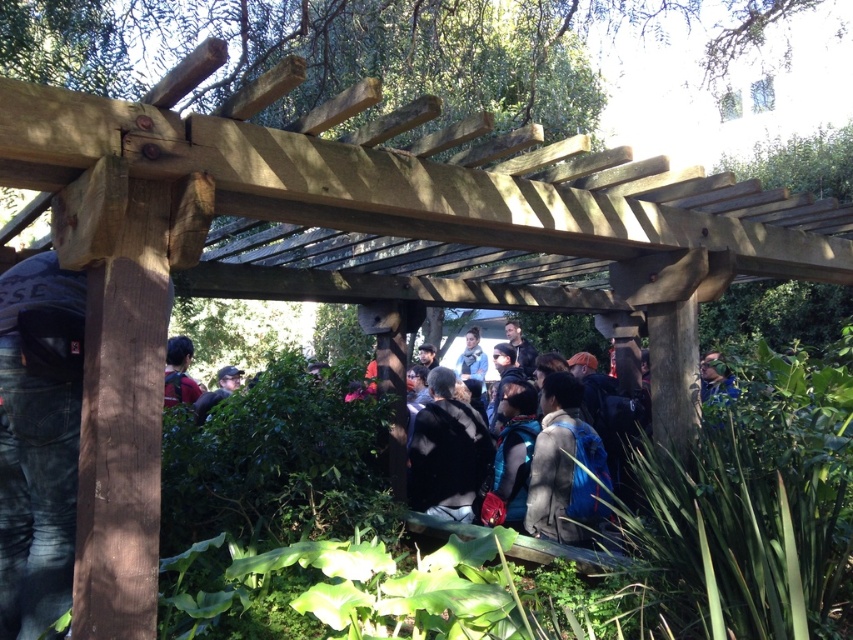
How far apart are dark green foliage at center and matte black backpack at center?

1.45 meters

Who is shorter, dark green foliage at center or matte black backpack at center?

With less height is matte black backpack at center.

This screenshot has height=640, width=853. What are the coordinates of `dark green foliage at center` in the screenshot? It's located at (747, 509).

Who is lower down, gray fabric jacket at center or blue denim jacket at center?

gray fabric jacket at center is lower down.

Consider the image. Can you confirm if gray fabric jacket at center is bigger than blue denim jacket at center?

Yes.

The width and height of the screenshot is (853, 640). Identify the location of gray fabric jacket at center. (563, 465).

Can you confirm if matte black backpack at left is positioned above blue denim jacket at center?

Yes.

Does matte black backpack at left have a larger size compared to blue denim jacket at center?

No.

Is point (194, 385) positioned after point (477, 352)?

No, it is not.

Identify the location of matte black backpack at left. (178, 372).